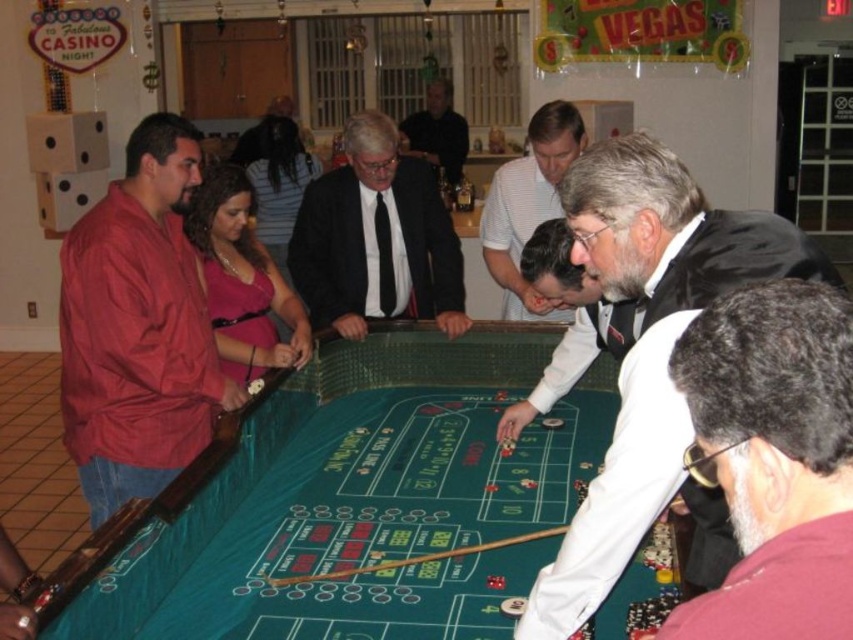
You are a photographer taking a picture of the casino event. You want to focus on the two points marked in the image. Which point is closer to your camera, point at coordinates (x=170, y=333) or point at coordinates (x=300, y=234)?

Point at coordinates (x=170, y=333) is closer to the camera than point at coordinates (x=300, y=234).